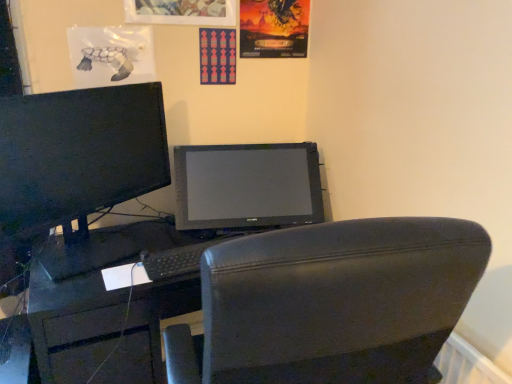
Identify the location of vacant location behind black matte keyboard at center. (191, 231).